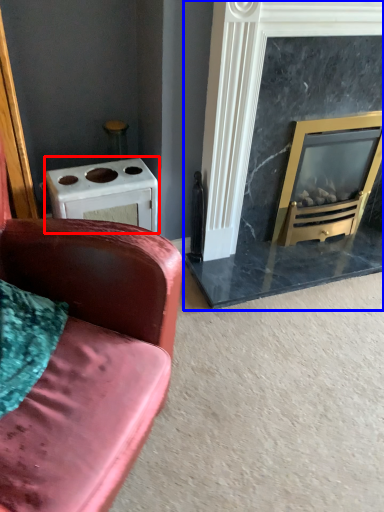
Question: Which of the following is the closest to the observer, appliance (highlighted by a red box) or fireplace (highlighted by a blue box)?

Choices:
 (A) appliance
 (B) fireplace

Answer: (B)